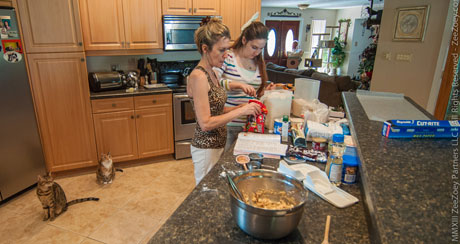
Locate an element on the screen. This screenshot has width=460, height=244. cabinet is located at coordinates (73, 140), (109, 137), (150, 136), (53, 37), (102, 29), (147, 25), (185, 6), (205, 9), (231, 13), (249, 12).